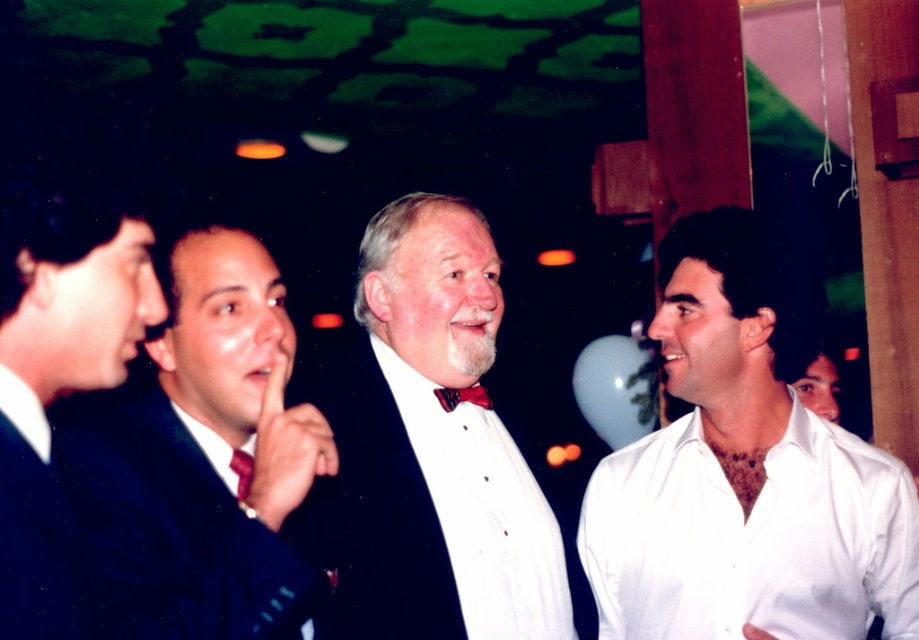
Question: Can you confirm if matte black suit at center is wider than red satin bow tie at center?

Choices:
 (A) yes
 (B) no

Answer: (A)

Question: Observing the image, what is the correct spatial positioning of white cotton shirt at right in reference to black suit at left?

Choices:
 (A) right
 (B) left

Answer: (A)

Question: Among these objects, which one is nearest to the camera?

Choices:
 (A) shiny red tie at center
 (B) red satin bow tie at center
 (C) shiny dark suit at center

Answer: (C)

Question: Where is shiny dark suit at center located in relation to black suit at left in the image?

Choices:
 (A) right
 (B) left

Answer: (A)

Question: Which point is farther to the camera?

Choices:
 (A) (489, 397)
 (B) (236, 465)
 (C) (74, 592)

Answer: (A)

Question: Among these objects, which one is nearest to the camera?

Choices:
 (A) matte black suit at center
 (B) white cotton shirt at right
 (C) red satin bow tie at center
 (D) shiny red tie at center

Answer: (D)